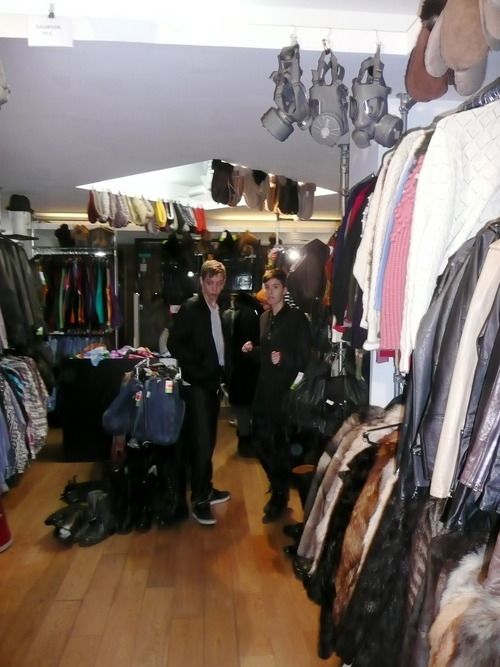
This screenshot has width=500, height=667. What are the coordinates of `wood floor` in the screenshot? It's located at (147, 625).